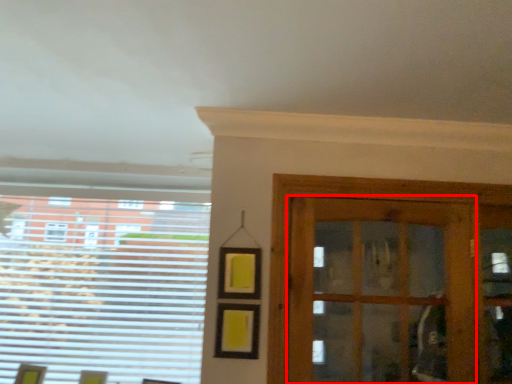
Question: Where is door (annotated by the red box) located in relation to window in the image?

Choices:
 (A) right
 (B) left

Answer: (A)